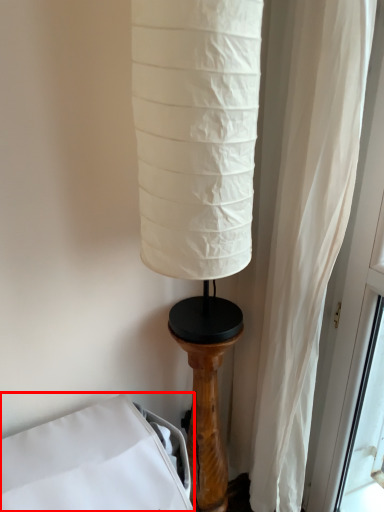
Question: From the image's perspective, what is the correct spatial positioning of furniture (annotated by the red box) in reference to pillar?

Choices:
 (A) above
 (B) below

Answer: (B)